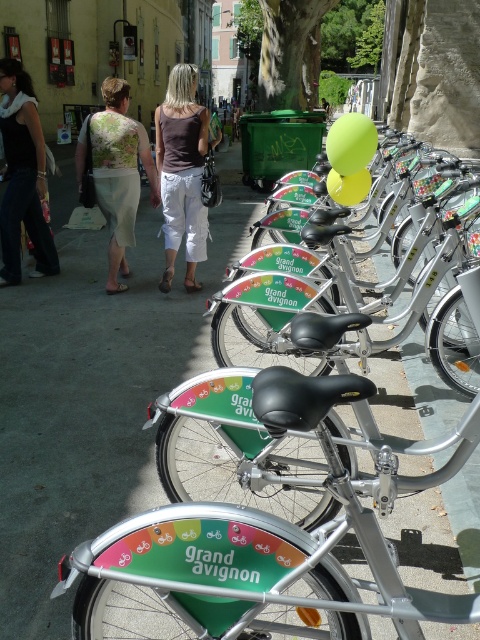
You are a delivery person who needs to attach a small package to your bicycle. You see a brown fabric tank top at center and a green fabric bag at center. Which item is closer to the left side of the bicycle where you can easily attach the package?

The brown fabric tank top at center is to the left of the green fabric bag at center, so it is closer to the left side of the bicycle where you can easily attach the package.

You are standing in front of the bicycles and want to take a photo. The camera is focused on the point at point (x=240, y=292). Will the point at point (x=6, y=157) be in focus?

Point (x=240, y=292) is closer to the camera than point (x=6, y=157). Since the camera is focused on the closer point, the point at (x=6, y=157) will likely be out of focus.